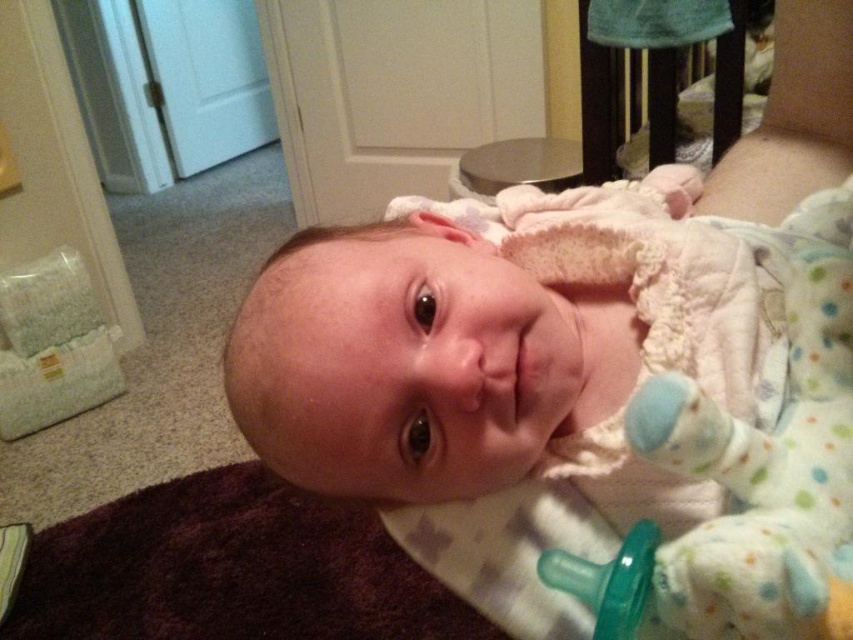
Question: Which object appears closest to the camera in this image?

Choices:
 (A) green rubber pacifier at lower center
 (B) white soft fabric baby at center
 (C) wooden crib at upper right

Answer: (B)

Question: Does white soft fabric baby at center have a larger size compared to green rubber pacifier at lower center?

Choices:
 (A) no
 (B) yes

Answer: (B)

Question: Considering the relative positions of white soft fabric baby at center and green rubber pacifier at lower center in the image provided, where is white soft fabric baby at center located with respect to green rubber pacifier at lower center?

Choices:
 (A) below
 (B) above

Answer: (B)

Question: Which point is farther to the camera?

Choices:
 (A) coord(666,204)
 (B) coord(749,13)
 (C) coord(614,563)

Answer: (B)

Question: Is white soft fabric baby at center positioned at the back of wooden crib at upper right?

Choices:
 (A) no
 (B) yes

Answer: (A)

Question: Which object is closer to the camera taking this photo?

Choices:
 (A) wooden crib at upper right
 (B) green rubber pacifier at lower center
 (C) white soft fabric baby at center

Answer: (C)